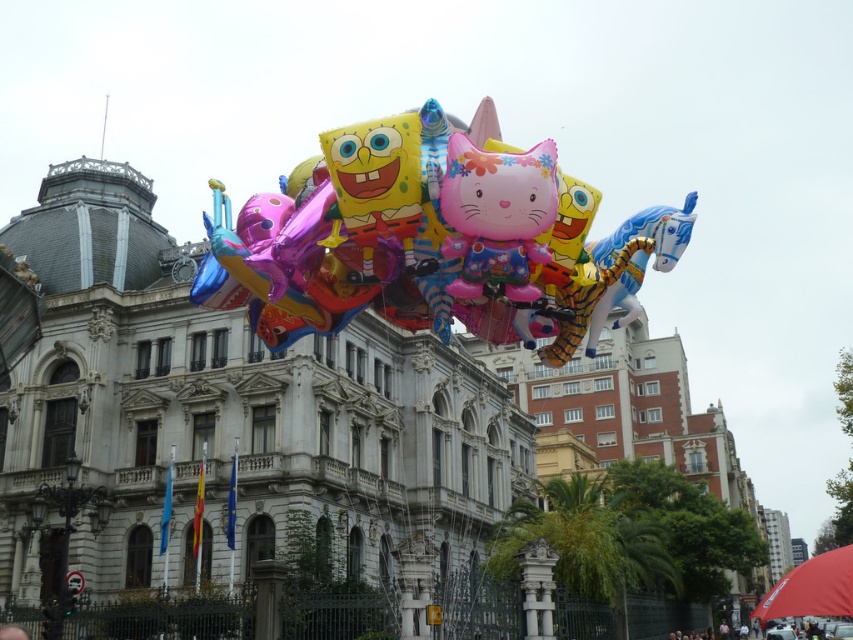
You are standing in front of the grand building and see the glossy plastic cat at center and the dark blue fabric at center. Which object is positioned to the left?

The glossy plastic cat at center is to the left of the dark blue fabric at center.

You are a photographer trying to capture the grand building in the background without any obstructions. You notice the glossy metallic balloons at center and the dark blue fabric at center are in front of the building. Which object should you move to get a clearer view of the building?

The glossy metallic balloons at center should be moved because they are larger and more likely to obstruct the view of the grand building compared to the dark blue fabric at center.